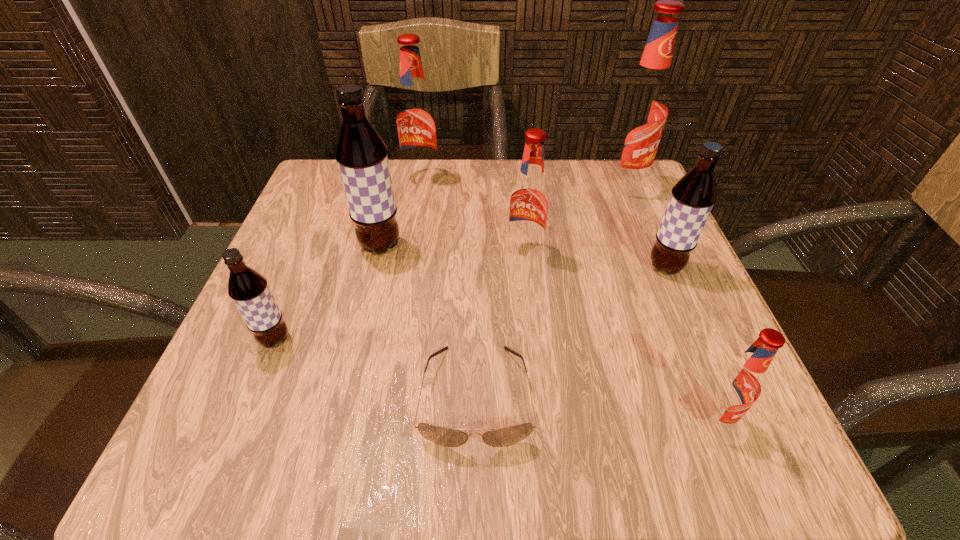
Locate an element on the screen. This screenshot has width=960, height=540. sunglasses at the near edge is located at coordinates (502, 437).

This screenshot has height=540, width=960. Find the location of `object that is positioned at the far right corner`. object that is positioned at the far right corner is located at coordinates (641, 113).

Identify the location of object that is at the near right corner. The image size is (960, 540). click(x=738, y=384).

In the image, there is a desktop. Where is `vacant space at the far edge`? vacant space at the far edge is located at coordinates (516, 179).

At what (x,y) coordinates should I click in order to perform the action: click on blank area at the near edge. Please return your answer as a coordinate pair (x, y). Looking at the image, I should click on (399, 425).

Image resolution: width=960 pixels, height=540 pixels. In the image, there is a desktop. Find the location of `free space at the left edge`. free space at the left edge is located at coordinates (313, 382).

Locate an element on the screen. vacant space at the right edge of the desktop is located at coordinates (658, 227).

At what (x,y) coordinates should I click in order to perform the action: click on vacant point at the near left corner. Please return your answer as a coordinate pair (x, y). Looking at the image, I should click on (248, 453).

The image size is (960, 540). Identify the location of blank space at the far right corner of the desktop. (627, 207).

Where is `free space between the third biggest red root beer and the shortest object`? free space between the third biggest red root beer and the shortest object is located at coordinates (500, 323).